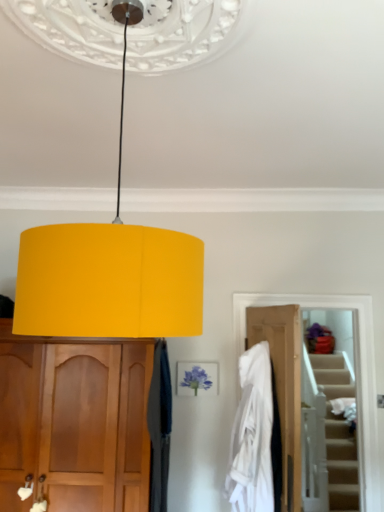
Question: Are matte yellow lampshade at center and matte wood cabinet at left far apart?

Choices:
 (A) yes
 (B) no

Answer: (A)

Question: Is matte yellow lampshade at center completely or partially outside of matte wood cabinet at left?

Choices:
 (A) no
 (B) yes

Answer: (B)

Question: Is matte yellow lampshade at center wider than matte wood cabinet at left?

Choices:
 (A) no
 (B) yes

Answer: (B)

Question: Can you confirm if matte yellow lampshade at center is thinner than matte wood cabinet at left?

Choices:
 (A) yes
 (B) no

Answer: (B)

Question: Considering the relative sizes of matte yellow lampshade at center and matte wood cabinet at left in the image provided, is matte yellow lampshade at center shorter than matte wood cabinet at left?

Choices:
 (A) yes
 (B) no

Answer: (A)

Question: In terms of width, does matte wood cabinet at left look wider or thinner when compared to matte yellow lampshade at center?

Choices:
 (A) wide
 (B) thin

Answer: (B)

Question: Considering the positions of matte wood cabinet at left and matte yellow lampshade at center in the image, is matte wood cabinet at left taller or shorter than matte yellow lampshade at center?

Choices:
 (A) short
 (B) tall

Answer: (B)

Question: Would you say matte wood cabinet at left is to the left or to the right of matte yellow lampshade at center in the picture?

Choices:
 (A) right
 (B) left

Answer: (B)

Question: From the image's perspective, relative to matte yellow lampshade at center, is matte wood cabinet at left above or below?

Choices:
 (A) below
 (B) above

Answer: (A)

Question: Looking at their shapes, would you say matte yellow lampshade at center is wider or thinner than velvet dark blue curtain at center?

Choices:
 (A) wide
 (B) thin

Answer: (A)

Question: From the image's perspective, relative to velvet dark blue curtain at center, is matte yellow lampshade at center above or below?

Choices:
 (A) above
 (B) below

Answer: (A)

Question: Based on their positions, is matte yellow lampshade at center located to the left or right of velvet dark blue curtain at center?

Choices:
 (A) right
 (B) left

Answer: (B)

Question: From their relative heights in the image, would you say matte yellow lampshade at center is taller or shorter than velvet dark blue curtain at center?

Choices:
 (A) short
 (B) tall

Answer: (A)

Question: Do you think velvet dark blue curtain at center is within white fabric at center, or outside of it?

Choices:
 (A) inside
 (B) outside

Answer: (B)

Question: From the image's perspective, is velvet dark blue curtain at center above or below white fabric at center?

Choices:
 (A) below
 (B) above

Answer: (A)